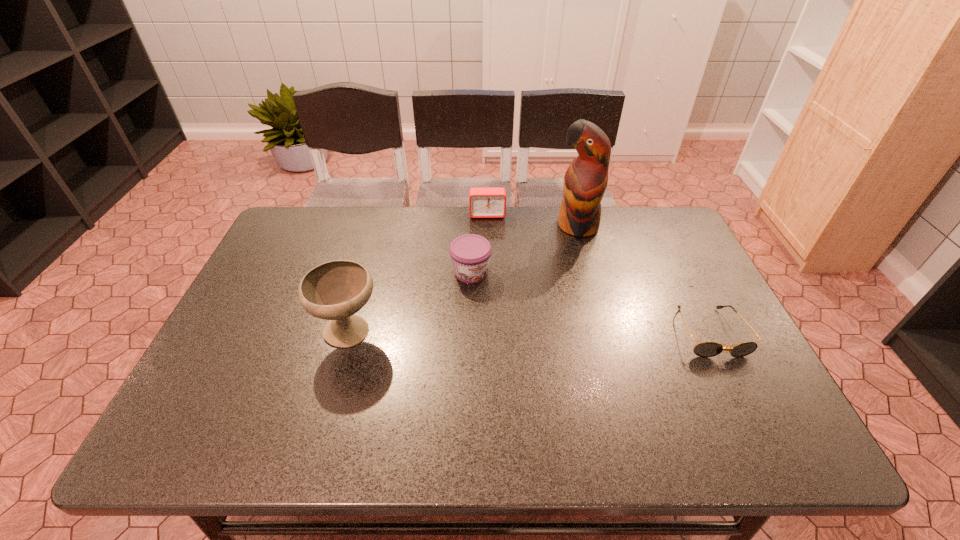
Identify the location of free space located 0.170m on the front label of the jam. (511, 326).

Locate an element on the screen. This screenshot has width=960, height=540. vacant position located 0.310m on the front label of the jam is located at coordinates (541, 366).

I want to click on free space located on the front label of the jam, so click(x=511, y=326).

The width and height of the screenshot is (960, 540). I want to click on blank space located on the front-facing side of the alarm clock, so click(490, 262).

At what (x,y) coordinates should I click in order to perform the action: click on free space located on the front-facing side of the alarm clock. Please return your answer as a coordinate pair (x, y). The width and height of the screenshot is (960, 540). Looking at the image, I should click on (491, 293).

Identify the location of vacant region located on the front-facing side of the alarm clock. (488, 232).

You are a GUI agent. You are given a task and a screenshot of the screen. Output one action in this format:
    pyautogui.click(x=<x>, y=<y>)
    Task: Click on the vacant region located on the face of the second object from right to left
    The image size is (960, 540).
    Given the screenshot: What is the action you would take?
    [x=557, y=260]

Find the location of a particular element. vacant point located 0.180m on the face of the second object from right to left is located at coordinates (548, 274).

At what (x,y) coordinates should I click in order to perform the action: click on vacant space located on the face of the second object from right to left. Please return your answer as a coordinate pair (x, y). The width and height of the screenshot is (960, 540). Looking at the image, I should click on (525, 309).

Identify the location of alarm clock present at the far edge. The image size is (960, 540). (483, 202).